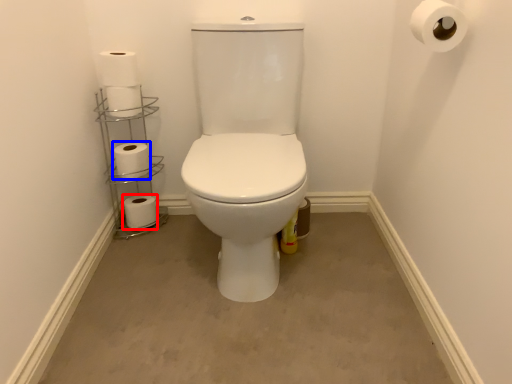
Question: Which object appears farthest to the camera in this image, toilet paper (highlighted by a red box) or toilet paper (highlighted by a blue box)?

Choices:
 (A) toilet paper
 (B) toilet paper

Answer: (A)